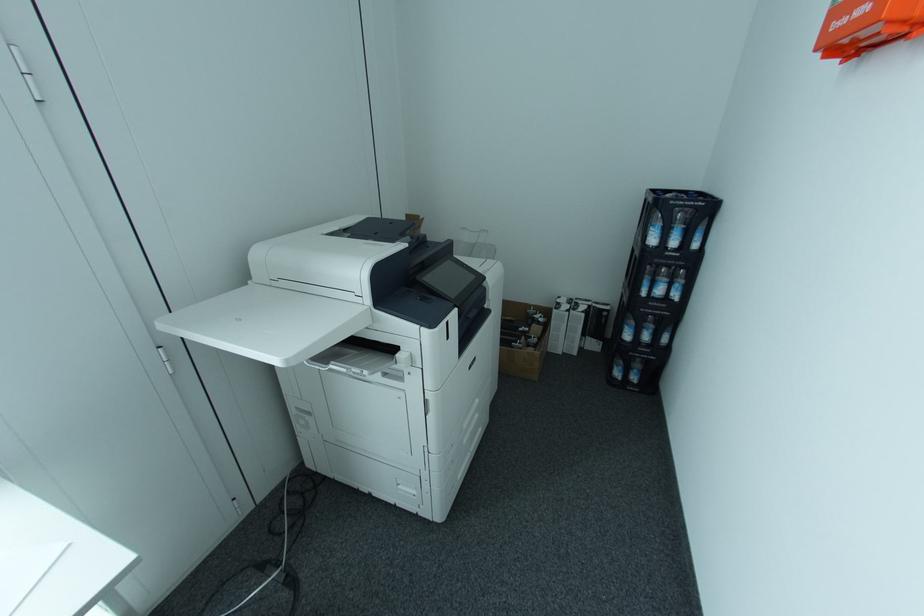
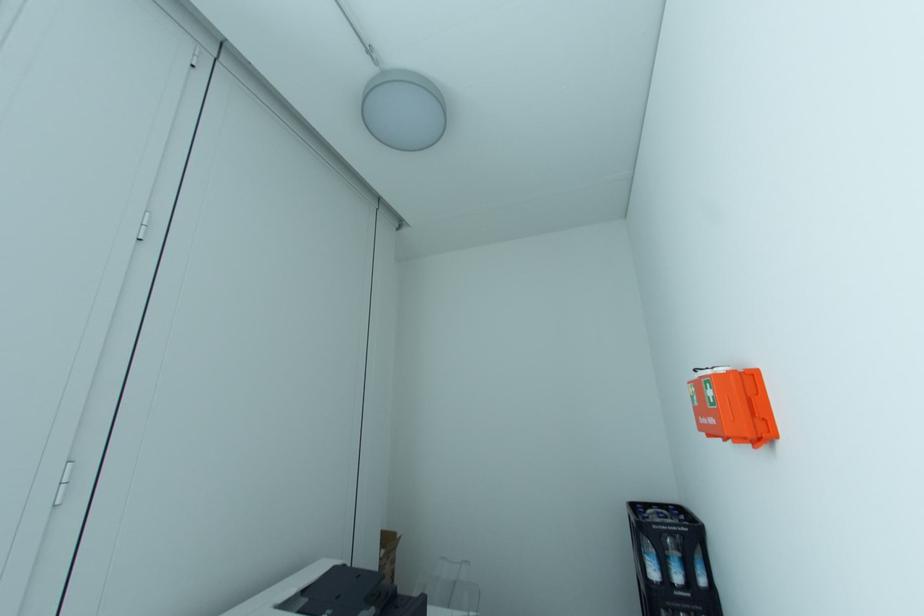
Question: The first image is from the beginning of the video and the second image is from the end. How did the camera likely rotate when shooting the video?

Choices:
 (A) Left
 (B) Right
 (C) Up
 (D) Down

Answer: (C)